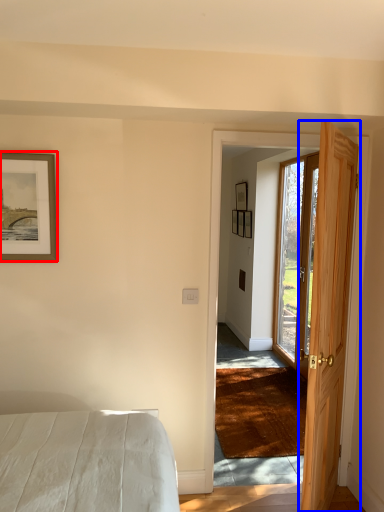
Question: Which object is further to the camera taking this photo, picture frame (highlighted by a red box) or door (highlighted by a blue box)?

Choices:
 (A) picture frame
 (B) door

Answer: (A)